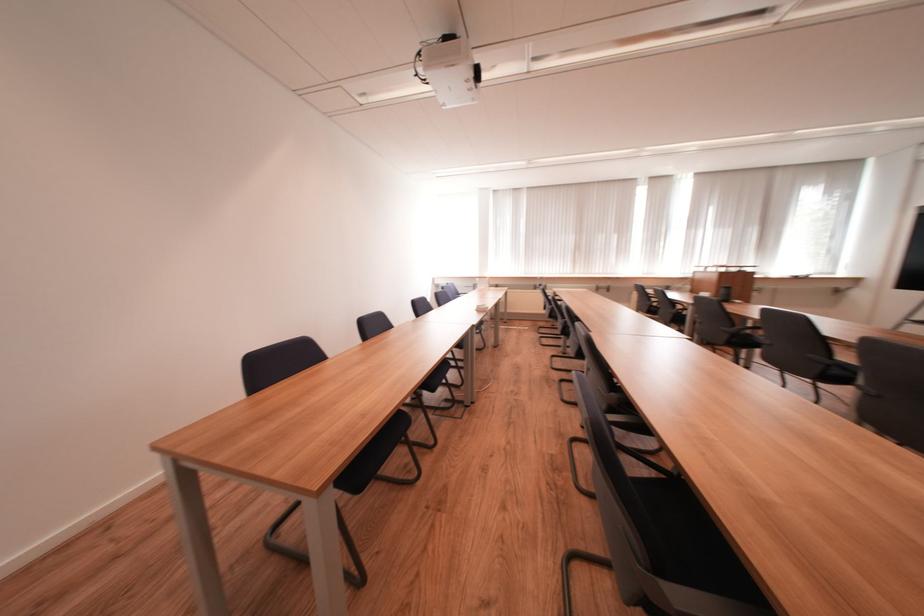
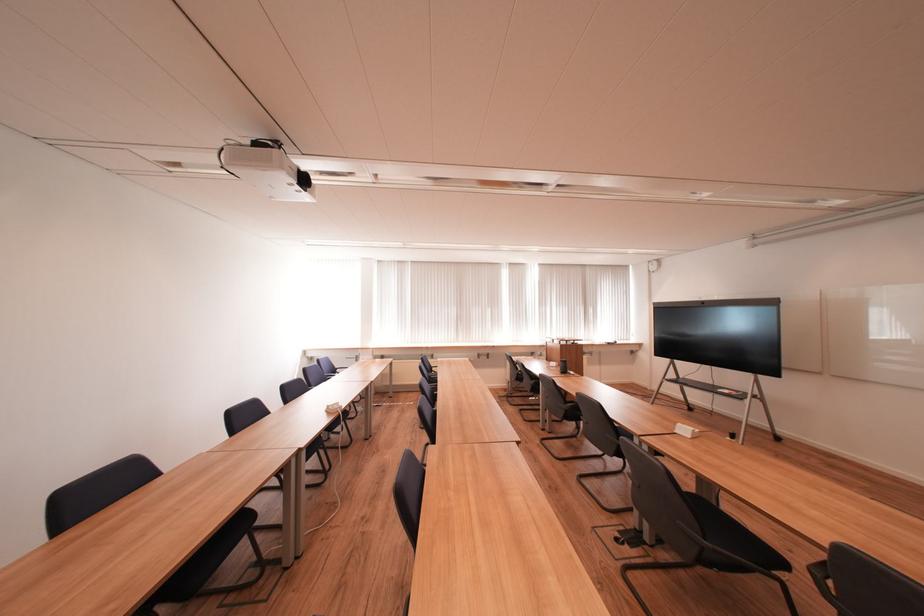
Question: The camera is either moving clockwise (left) or counter-clockwise (right) around the object. The first image is from the beginning of the video and the second image is from the end. Is the camera moving left or right when shooting the video?

Choices:
 (A) Left
 (B) Right

Answer: (A)